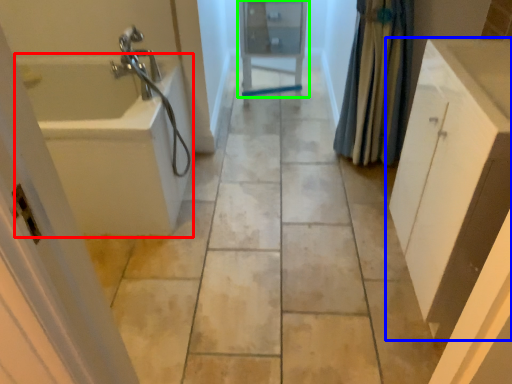
Question: Which is nearer to the bath (highlighted by a red box)? bathroom cabinet (highlighted by a blue box) or medicine cabinet (highlighted by a green box).

Choices:
 (A) bathroom cabinet
 (B) medicine cabinet

Answer: (B)